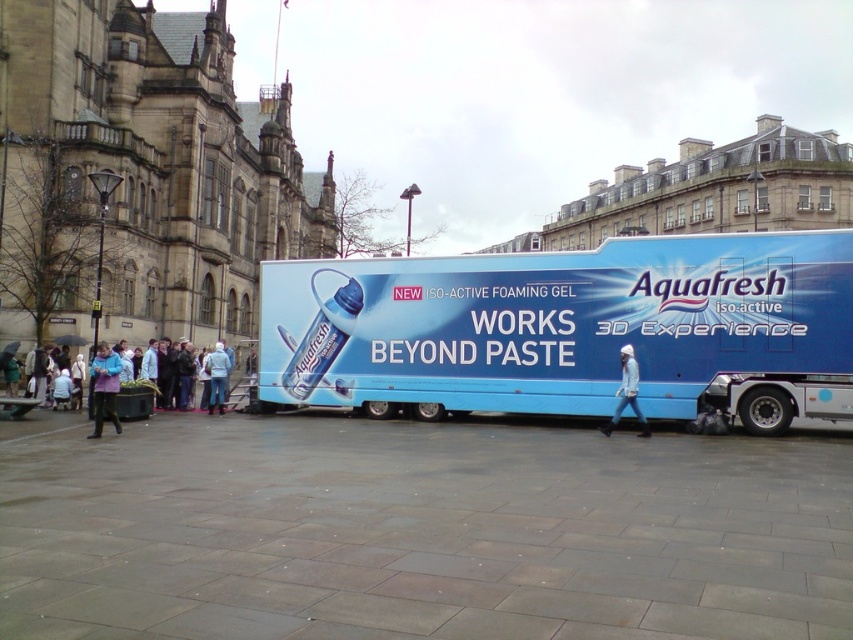
You are a photographer standing in the street. You want to take a photo of the blue glossy bus at center and the blue fleece jacket at lower left. Which object should you focus on first if you want both to be in sharp focus?

The blue glossy bus at center is much taller than the blue fleece jacket at lower left, so you should focus on the blue glossy bus at center first to ensure both are in sharp focus.

You are a photographer trying to capture both the white knit hat at center and the white fabric jacket at center in a single frame. Which object will appear smaller in the photo?

The white knit hat at center will appear smaller in the photo because it occupies less space than the white fabric jacket at center.